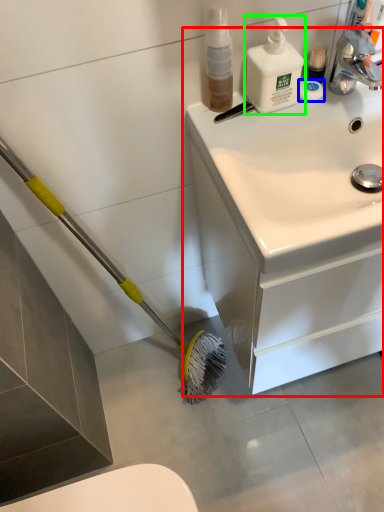
Question: Which is farther away from bathroom cabinet (highlighted by a red box)? soap (highlighted by a blue box) or cleaning product (highlighted by a green box)?

Choices:
 (A) soap
 (B) cleaning product

Answer: (A)